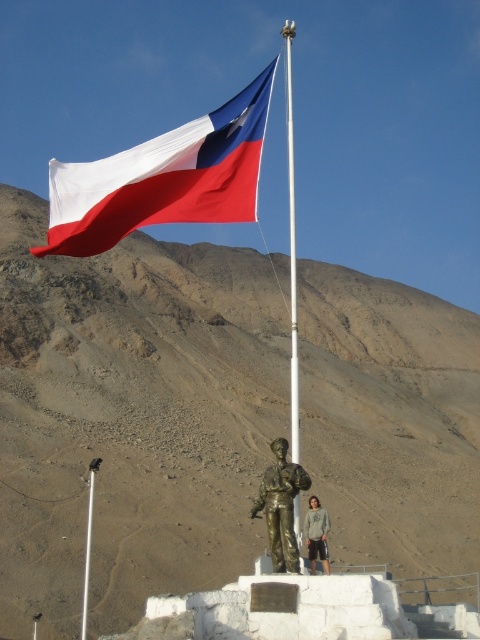
Question: Which object appears closest to the camera in this image?

Choices:
 (A) matte fabric flag at upper center
 (B) bronze statue at center

Answer: (B)

Question: Which point is closer to the camera taking this photo?

Choices:
 (A) (156, 208)
 (B) (290, 177)
 (C) (307, 525)
 (D) (82, 628)

Answer: (A)

Question: Does gray cotton hoodie at center have a smaller size compared to white metallic pole at center?

Choices:
 (A) yes
 (B) no

Answer: (A)

Question: Can you confirm if bronze statue at center is positioned to the left of white metallic flag pole at center?

Choices:
 (A) no
 (B) yes

Answer: (B)

Question: Is the position of bronze statue at center more distant than that of white metallic pole at center?

Choices:
 (A) yes
 (B) no

Answer: (B)

Question: Which object is closer to the camera taking this photo?

Choices:
 (A) bronze statue at center
 (B) matte fabric flag at upper center
 (C) gray cotton hoodie at center
 (D) white metallic pole at center

Answer: (A)